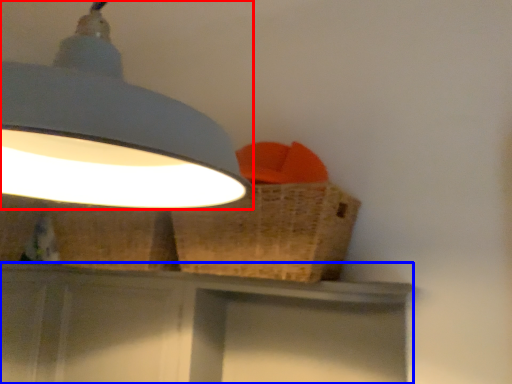
Question: Which point is further to the camera, lamp (highlighted by a red box) or vanity (highlighted by a blue box)?

Choices:
 (A) lamp
 (B) vanity

Answer: (B)